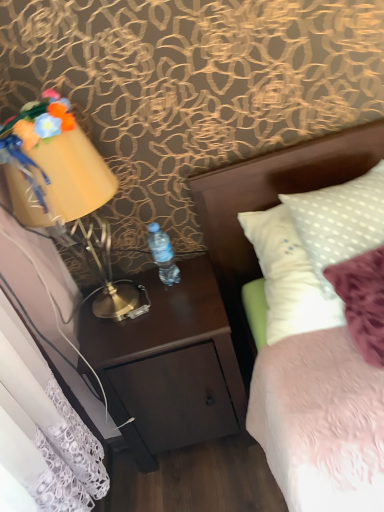
What do you see at coordinates (273, 193) in the screenshot?
I see `white fabric headboard at upper right` at bounding box center [273, 193].

In order to face matte yellow lampshade at left, should I rotate leftwards or rightwards?

To align with it, rotate left about 15.302°.

Where is `clear plastic bottle at center`? The width and height of the screenshot is (384, 512). clear plastic bottle at center is located at coordinates pyautogui.click(x=163, y=254).

Considering the relative sizes of dark wood nightstand at center and matte yellow lampshade at left in the image provided, is dark wood nightstand at center thinner than matte yellow lampshade at left?

No, dark wood nightstand at center is not thinner than matte yellow lampshade at left.

In the image, there is a matte yellow lampshade at left. At what (x,y) coordinates should I click in order to perform the action: click on nightstand below it (from a real-world perspective). Please return your answer as a coordinate pair (x, y). The image size is (384, 512). Looking at the image, I should click on (169, 365).

From a real-world perspective, is dark wood nightstand at center physically above matte yellow lampshade at left?

Actually, dark wood nightstand at center is physically below matte yellow lampshade at left in the real world.

Does dark wood nightstand at center turn towards matte yellow lampshade at left?

No, dark wood nightstand at center is not facing towards matte yellow lampshade at left.

This screenshot has height=512, width=384. I want to click on nightstand behind the fluffy fabric flowers at upper left, so click(169, 365).

Is fluffy fabric flowers at upper left smaller than dark wood nightstand at center?

Correct, fluffy fabric flowers at upper left occupies less space than dark wood nightstand at center.

From a real-world perspective, which object rests below the other?

dark wood nightstand at center.

How much distance is there between fluffy fabric flowers at upper left and dark wood nightstand at center?

fluffy fabric flowers at upper left is 29.17 inches away from dark wood nightstand at center.

Considering their positions, is clear plastic bottle at center located in front of or behind dark wood nightstand at center?

clear plastic bottle at center is positioned farther from the viewer than dark wood nightstand at center.

Which object is positioned more to the right, clear plastic bottle at center or dark wood nightstand at center?

dark wood nightstand at center.

Is clear plastic bottle at center not near dark wood nightstand at center?

clear plastic bottle at center is actually quite close to dark wood nightstand at center.

In the scene shown: Does clear plastic bottle at center have a smaller size compared to dark wood nightstand at center?

Yes, clear plastic bottle at center is smaller than dark wood nightstand at center.

How many degrees apart are the facing directions of matte yellow lampshade at left and fluffy fabric flowers at upper left?

The angular difference between matte yellow lampshade at left and fluffy fabric flowers at upper left is 2.73e-05 degrees.

Which object is further away from the camera taking this photo, matte yellow lampshade at left or fluffy fabric flowers at upper left?

fluffy fabric flowers at upper left is behind.

Is matte yellow lampshade at left oriented away from fluffy fabric flowers at upper left?

That's not correct — matte yellow lampshade at left is not looking away from fluffy fabric flowers at upper left.

You are a GUI agent. You are given a task and a screenshot of the screen. Output one action in this format:
    pyautogui.click(x=<x>, y=<y>)
    Task: Click on the bedside lamp that appears below the fluffy fabric flowers at upper left (from the image's perspective)
    This screenshot has height=512, width=384.
    Given the screenshot: What is the action you would take?
    pyautogui.click(x=64, y=189)

Considering the sizes of objects white fabric headboard at upper right and matte yellow lampshade at left in the image provided, who is smaller, white fabric headboard at upper right or matte yellow lampshade at left?

Smaller between the two is white fabric headboard at upper right.

Is white fabric headboard at upper right oriented away from matte yellow lampshade at left?

That's not correct — white fabric headboard at upper right is not looking away from matte yellow lampshade at left.

From a real-world perspective, who is located lower, white fabric headboard at upper right or matte yellow lampshade at left?

From a 3D spatial view, white fabric headboard at upper right is below.

Is point (250, 277) less distant than point (31, 169)?

No.

Is matte yellow lampshade at left to the right of white fabric headboard at upper right from the viewer's perspective?

No.

From a real-world perspective, is matte yellow lampshade at left positioned above or below white fabric headboard at upper right?

matte yellow lampshade at left is situated higher than white fabric headboard at upper right in the real world.

Is matte yellow lampshade at left bigger than white fabric headboard at upper right?

Indeed, matte yellow lampshade at left has a larger size compared to white fabric headboard at upper right.

Considering the relative sizes of clear plastic bottle at center and white fabric headboard at upper right in the image provided, is clear plastic bottle at center smaller than white fabric headboard at upper right?

Indeed, clear plastic bottle at center has a smaller size compared to white fabric headboard at upper right.

Considering the sizes of clear plastic bottle at center and white fabric headboard at upper right in the image, is clear plastic bottle at center taller or shorter than white fabric headboard at upper right?

clear plastic bottle at center is shorter than white fabric headboard at upper right.

From the picture: Can you see clear plastic bottle at center touching white fabric headboard at upper right?

No, clear plastic bottle at center is not with white fabric headboard at upper right.

In the image, there is a matte yellow lampshade at left. Where is `nightstand below it (from the image's perspective)`? This screenshot has width=384, height=512. nightstand below it (from the image's perspective) is located at coordinates (169, 365).

Where is `flower located above the dark wood nightstand at center (from the image's perspective)`? This screenshot has height=512, width=384. flower located above the dark wood nightstand at center (from the image's perspective) is located at coordinates (39, 121).

From the image, which object appears to be farther from clear plastic bottle at center, fluffy fabric flowers at upper left or dark wood nightstand at center?

fluffy fabric flowers at upper left is further to clear plastic bottle at center.

Based on their spatial positions, is clear plastic bottle at center or fluffy fabric flowers at upper left closer to matte yellow lampshade at left?

The object closer to matte yellow lampshade at left is fluffy fabric flowers at upper left.

When comparing their distances from fluffy fabric flowers at upper left, does dark wood nightstand at center or white fabric headboard at upper right seem closer?

Based on the image, white fabric headboard at upper right appears to be nearer to fluffy fabric flowers at upper left.

From the image, which object appears to be farther from dark wood nightstand at center, fluffy fabric flowers at upper left or white fabric headboard at upper right?

Among the two, fluffy fabric flowers at upper left is located further to dark wood nightstand at center.

When comparing their distances from white fabric headboard at upper right, does clear plastic bottle at center or dark wood nightstand at center seem closer?

The object closer to white fabric headboard at upper right is clear plastic bottle at center.

From the image, which object appears to be farther from dark wood nightstand at center, matte yellow lampshade at left or clear plastic bottle at center?

matte yellow lampshade at left is further to dark wood nightstand at center.

Looking at the image, which one is located closer to white fabric headboard at upper right, clear plastic bottle at center or fluffy fabric flowers at upper left?

The object closer to white fabric headboard at upper right is clear plastic bottle at center.

Looking at the image, which one is located further to white fabric headboard at upper right, clear plastic bottle at center or matte yellow lampshade at left?

Based on the image, matte yellow lampshade at left appears to be further to white fabric headboard at upper right.

This screenshot has height=512, width=384. Identify the location of bedside lamp between fluffy fabric flowers at upper left and dark wood nightstand at center in the vertical direction. (64, 189).

Identify the location of nightstand between fluffy fabric flowers at upper left and white fabric headboard at upper right. (169, 365).

The height and width of the screenshot is (512, 384). What are the coordinates of `bottle between matte yellow lampshade at left and dark wood nightstand at center vertically` in the screenshot? It's located at (163, 254).

Identify the location of bottle between fluffy fabric flowers at upper left and dark wood nightstand at center vertically. The image size is (384, 512). (163, 254).